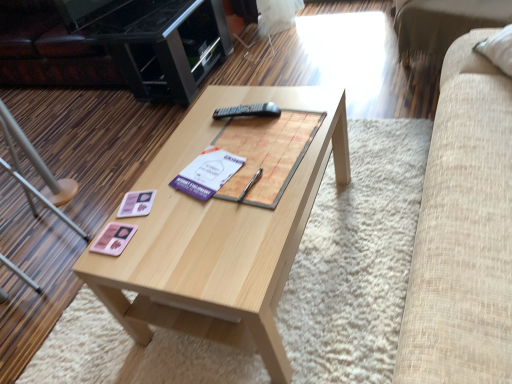
The width and height of the screenshot is (512, 384). Identify the location of vacant space in between white paper at center and pink matte card game at center. (162, 215).